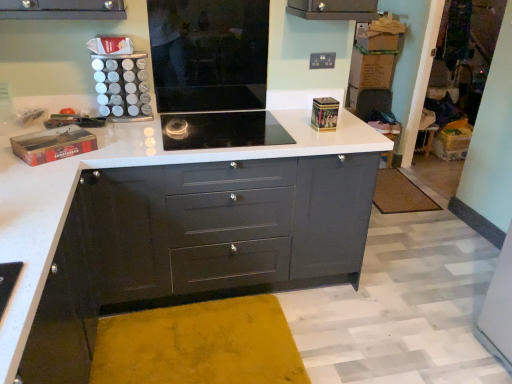
Locate an element on the screen. blank space above brown textured mat at lower right (from a real-world perspective) is located at coordinates (399, 190).